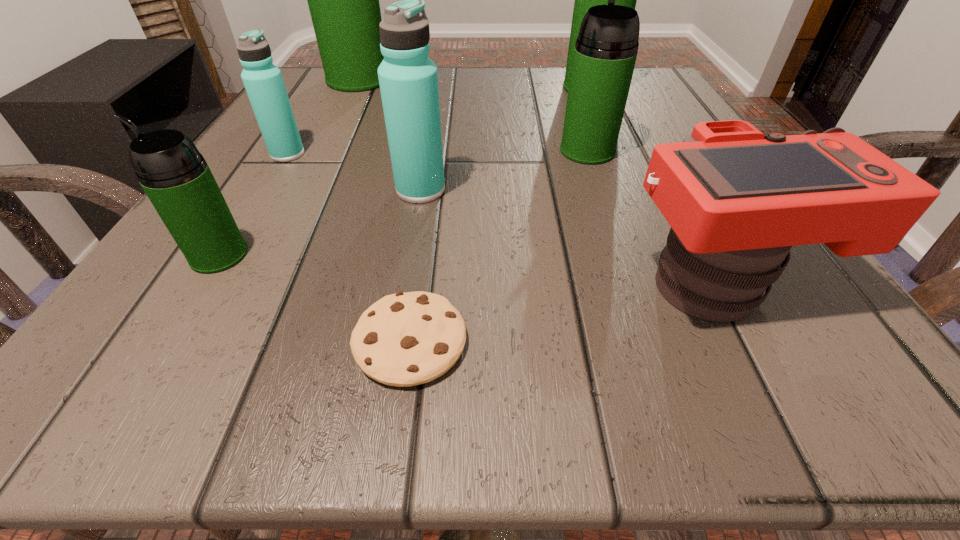
Identify which green thermos bottle is located as the second nearest to the cookie. Please provide its 2D coordinates. Your answer should be formatted as a tuple, i.e. [(x, y)], where the tuple contains the x and y coordinates of a point satisfying the conditions above.

[(606, 48)]

Locate which green thermos bottle is the closest to the second smallest green thermos bottle. Please provide its 2D coordinates. Your answer should be formatted as a tuple, i.e. [(x, y)], where the tuple contains the x and y coordinates of a point satisfying the conditions above.

[(584, 0)]

Find the location of a particular element. This screenshot has width=960, height=540. vacant area in the image that satisfies the following two spatial constraints: 1. from the spout of the tallest object; 2. from the spout of the second nearest green thermos bottle is located at coordinates [323, 151].

Identify the location of free space that satisfies the following two spatial constraints: 1. from the spout of the second nearest green thermos bottle; 2. from the spout of the biggest green thermos bottle. (564, 80).

Locate an element on the screen. The width and height of the screenshot is (960, 540). free location that satisfies the following two spatial constraints: 1. from the spout of the second biggest green thermos bottle; 2. on the front side of the shortest object is located at coordinates (701, 341).

Find the location of a particular element. The width and height of the screenshot is (960, 540). free space that satisfies the following two spatial constraints: 1. from the spout of the second biggest green thermos bottle; 2. on the front side of the smaller aqua thermos bottle is located at coordinates (619, 154).